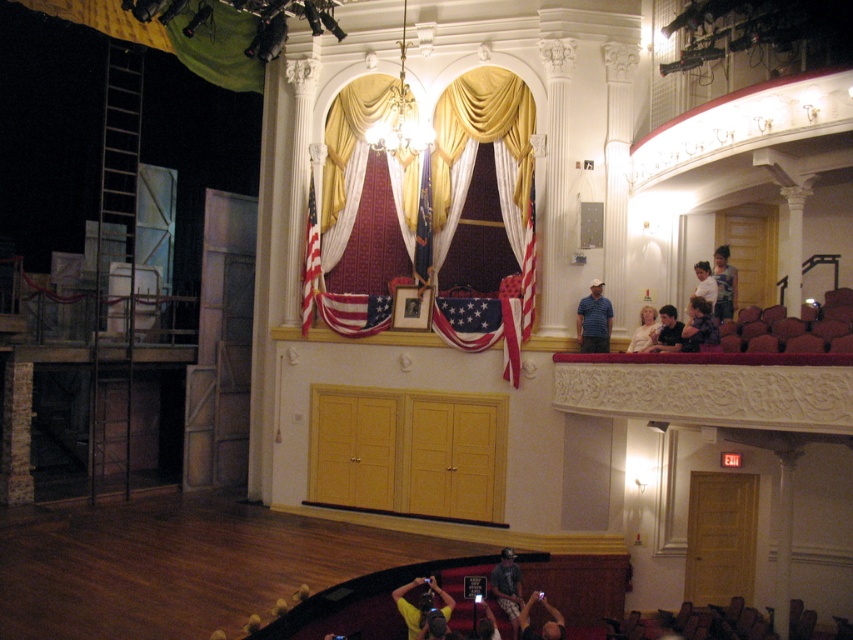
Which is more to the left, blue shirt at upper center or white cotton shirt at upper right?

blue shirt at upper center is more to the left.

Can you confirm if blue shirt at upper center is shorter than white cotton shirt at upper right?

No, blue shirt at upper center is not shorter than white cotton shirt at upper right.

Does point (608, 326) come behind point (705, 289)?

That is True.

Where is `blue shirt at upper center`? This screenshot has height=640, width=853. blue shirt at upper center is located at coordinates (595, 321).

Who is more forward, [578,308] or [508,602]?

Positioned in front is point [508,602].

Does blue shirt at upper center have a greater height compared to dark brown textured shirt at lower center?

Yes.

Is point (584, 344) in front of point (503, 550)?

No, it is behind (503, 550).

Identify the location of blue shirt at upper center. (595, 321).

Image resolution: width=853 pixels, height=640 pixels. What do you see at coordinates (508, 586) in the screenshot? I see `dark brown textured shirt at lower center` at bounding box center [508, 586].

Which is behind, point (491, 570) or point (695, 321)?

Positioned behind is point (491, 570).

Is point (505, 600) in front of point (709, 342)?

No, it is not.

Locate an element on the screen. Image resolution: width=853 pixels, height=640 pixels. dark brown textured shirt at lower center is located at coordinates (x=508, y=586).